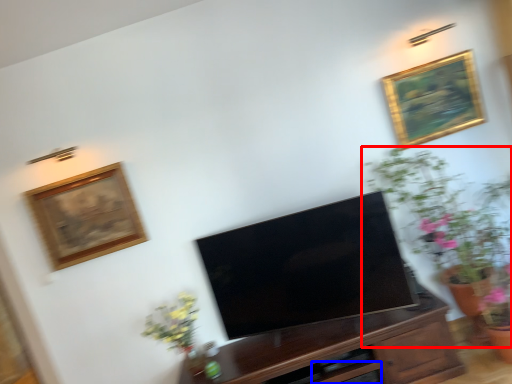
Question: Which object appears closest to the camera in this image, houseplant (highlighted by a red box) or drawer (highlighted by a blue box)?

Choices:
 (A) houseplant
 (B) drawer

Answer: (A)